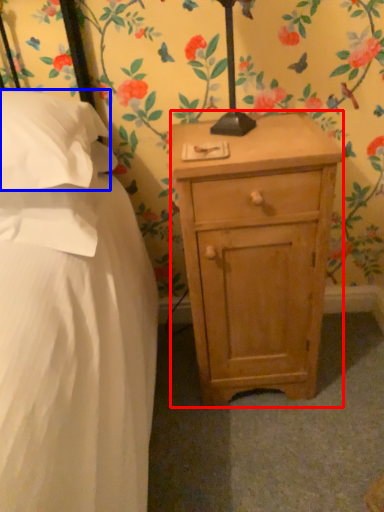
Question: Among these objects, which one is farthest to the camera, nightstand (highlighted by a red box) or pillow (highlighted by a blue box)?

Choices:
 (A) nightstand
 (B) pillow

Answer: (A)